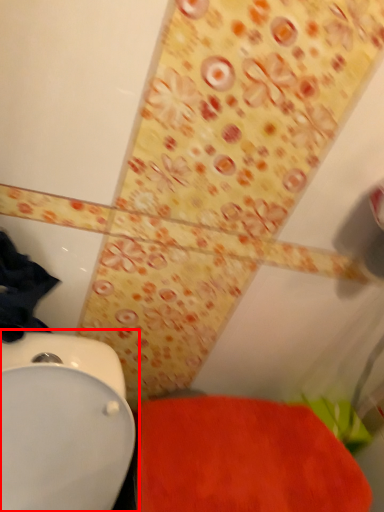
Question: Considering the relative positions of toilet (annotated by the red box) and bath mat in the image provided, where is toilet (annotated by the red box) located with respect to the staircase?

Choices:
 (A) left
 (B) right

Answer: (A)